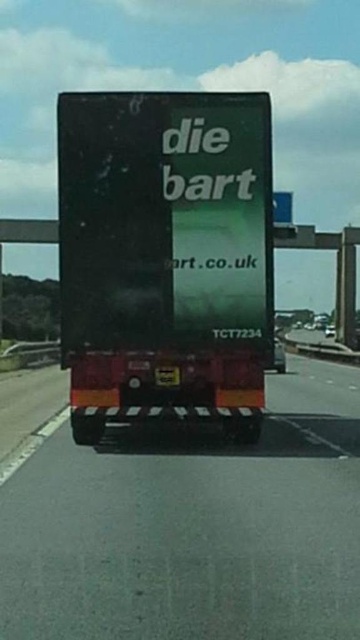
Question: Does black rubber truck at center appear under matte black truck at center?

Choices:
 (A) yes
 (B) no

Answer: (A)

Question: Which point is farther to the camera?

Choices:
 (A) (246, 323)
 (B) (50, 520)

Answer: (A)

Question: Can you confirm if black rubber truck at center is wider than matte black truck at center?

Choices:
 (A) yes
 (B) no

Answer: (A)

Question: Among these points, which one is farthest from the camera?

Choices:
 (A) (248, 595)
 (B) (150, 164)

Answer: (B)

Question: Can you confirm if black rubber truck at center is positioned to the right of matte black truck at center?

Choices:
 (A) no
 (B) yes

Answer: (B)